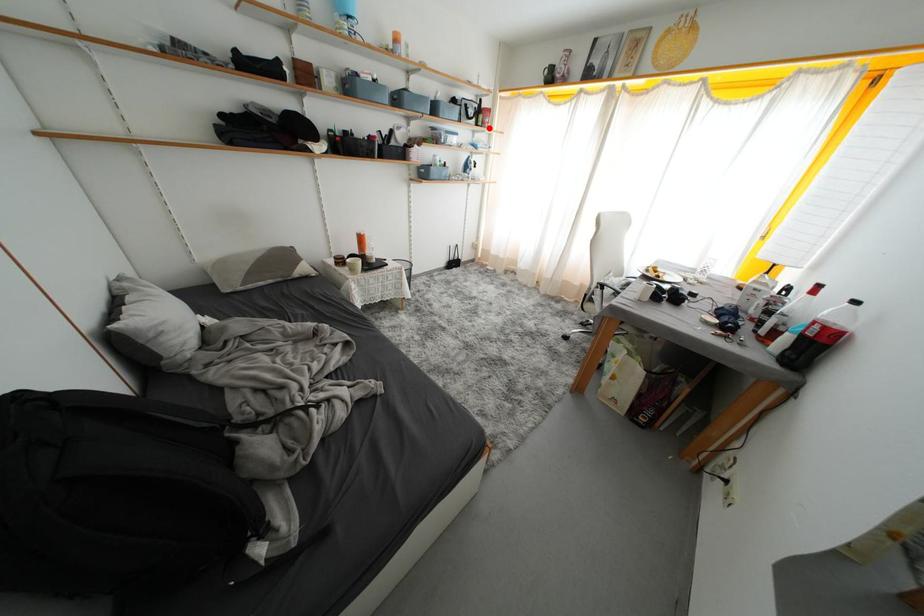
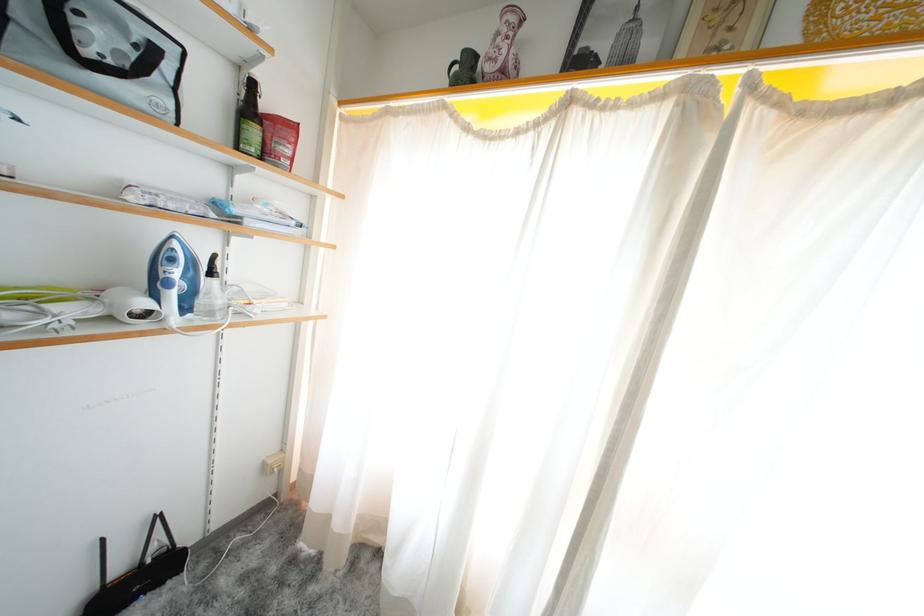
Question: I am providing you with two images of the same scene from different viewpoints. A red point is shown in image1. For the corresponding object point in image2, is it positioned nearer or farther from the camera?

Choices:
 (A) Nearer
 (B) Farther

Answer: (B)